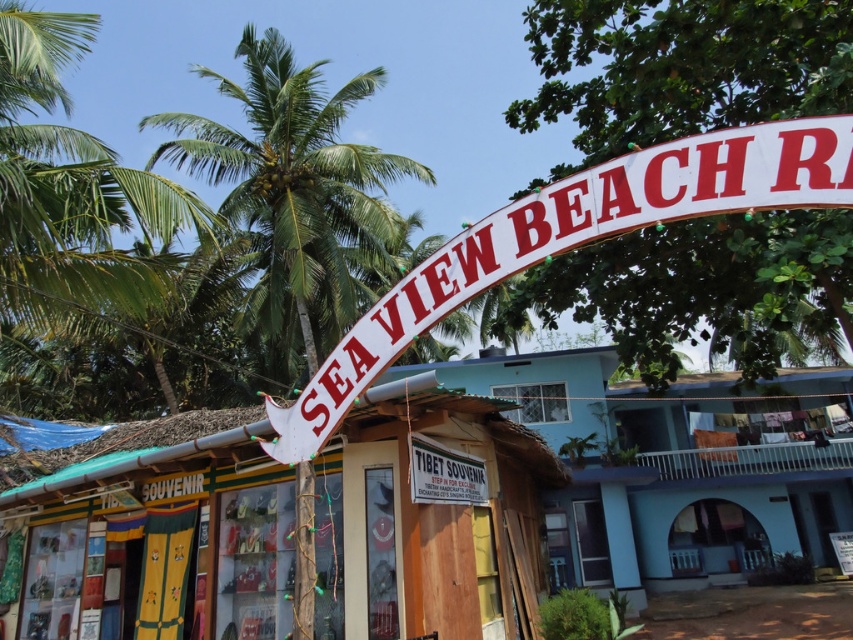
You are standing at the beach and want to take a photo of both the white wooden signboard at center and the green leafy palm tree at upper center. Which object should you focus on first if you want to include both in your frame without moving your camera?

You should focus on the white wooden signboard at center first because it is thinner than the green leafy palm tree at upper center, allowing it to fit better within the frame when combined with the wider palm tree.

You are standing at the entrance of the beach and want to take a photo of both the wooden hut at center and the green leafy palm tree at upper center. Which object should you position closer to the camera to ensure both fit in the frame?

Since the wooden hut at center might be wider than the green leafy palm tree at upper center, you should position the wooden hut at center closer to the camera to ensure both fit in the frame.

What object is located at the coordinates point (430,516) in the image?

The point (430,516) corresponds to the white wooden signboard at center.